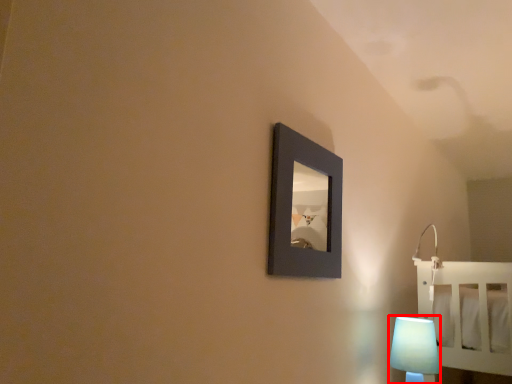
Question: From the image's perspective, where is lamp (annotated by the red box) located relative to picture frame?

Choices:
 (A) above
 (B) below

Answer: (B)